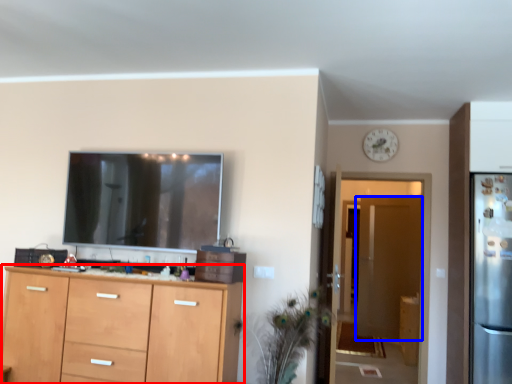
Question: Which of the following is the closest to the observer, cabinetry (highlighted by a red box) or door (highlighted by a blue box)?

Choices:
 (A) cabinetry
 (B) door

Answer: (A)